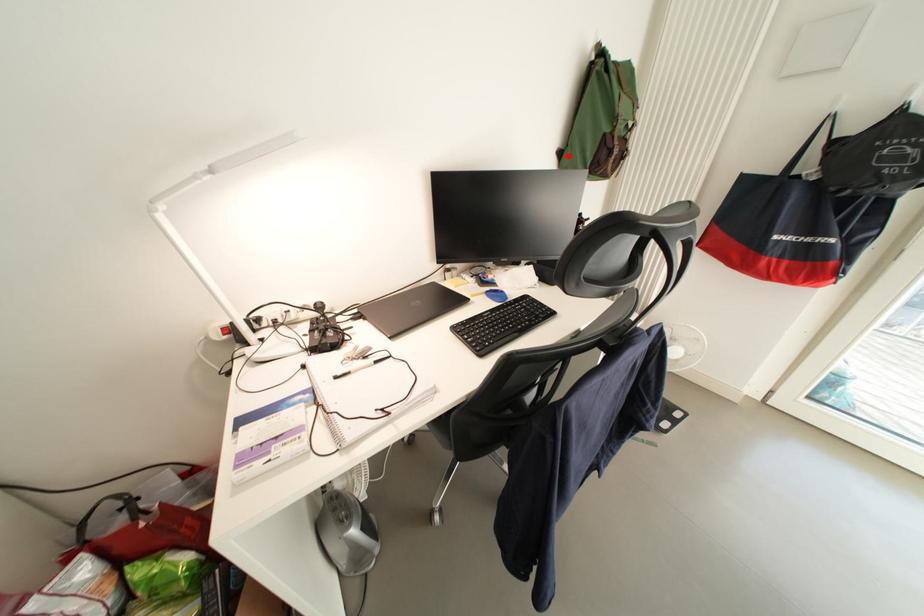
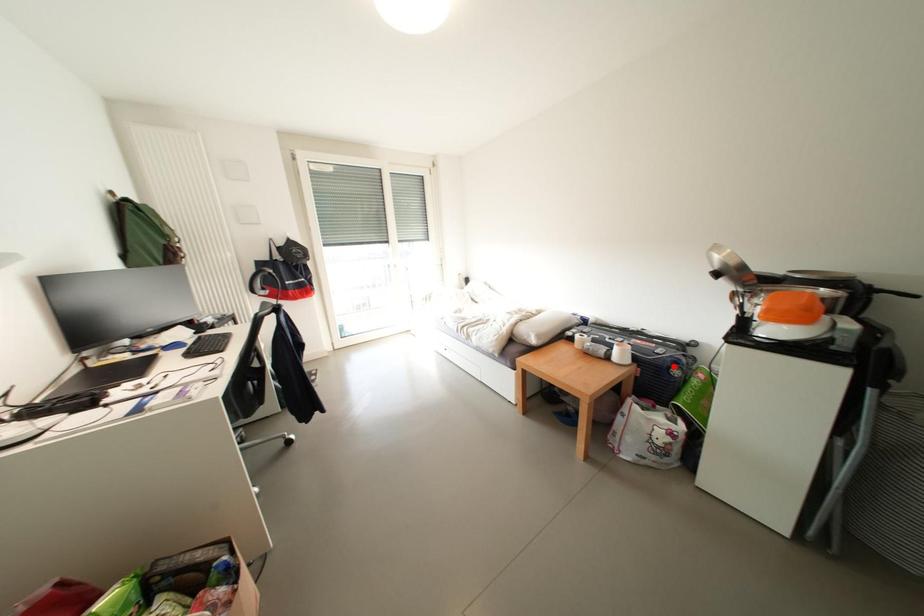
I am providing you with two images of the same scene from different viewpoints. A red point is marked on the first image and another point is marked on the second image. Is the red point in image1 aligned with the point shown in image2?

No